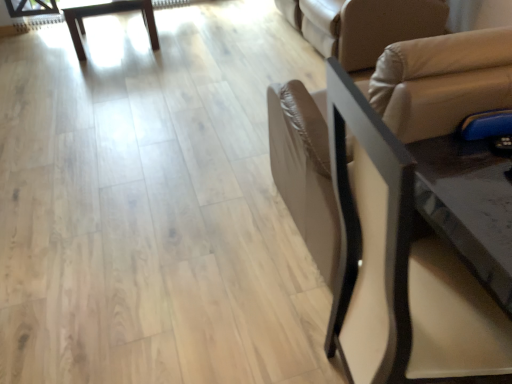
Locate an element on the screen. This screenshot has height=384, width=512. vacant space in between wooden table at upper left and black leather chair at right is located at coordinates pos(183,142).